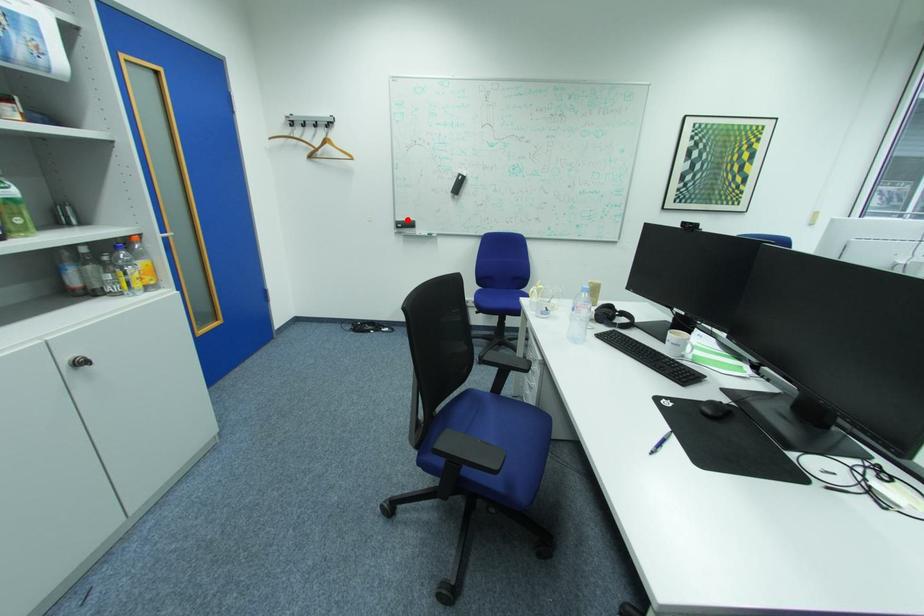
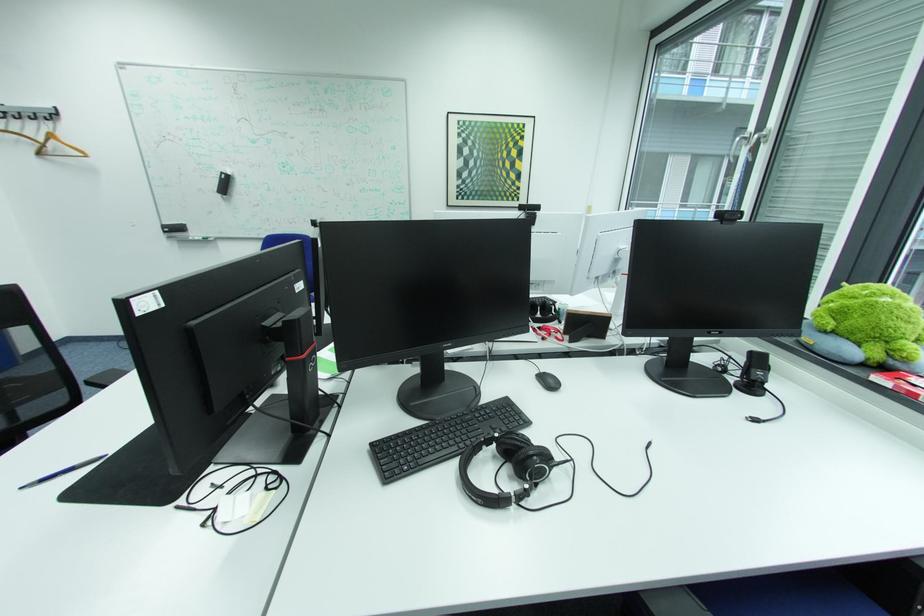
The point at the highlighted location is marked in the first image. Where is the corresponding point in the second image?

(175, 223)